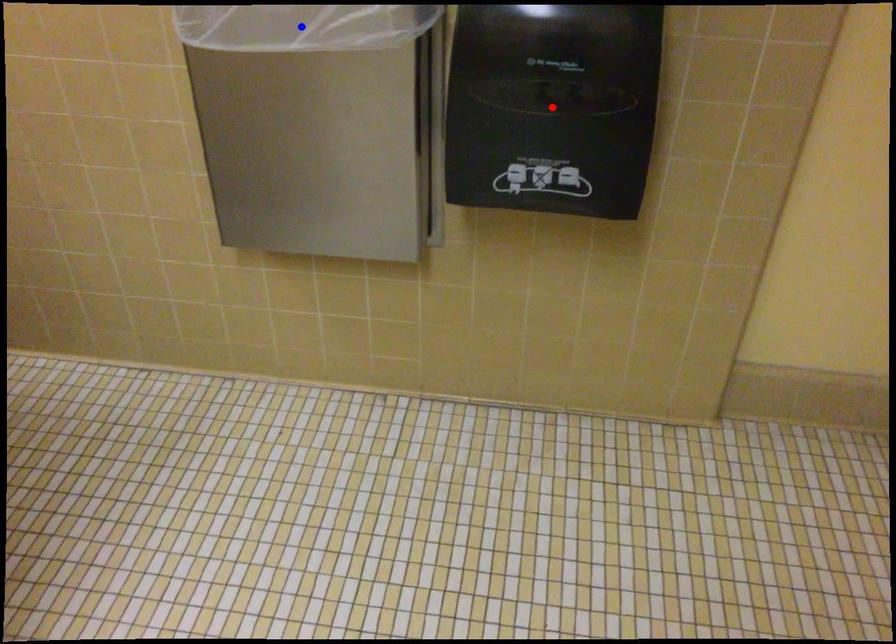
Question: Which of the two points in the image is closer to the camera?

Choices:
 (A) Blue point is closer.
 (B) Red point is closer.

Answer: (A)